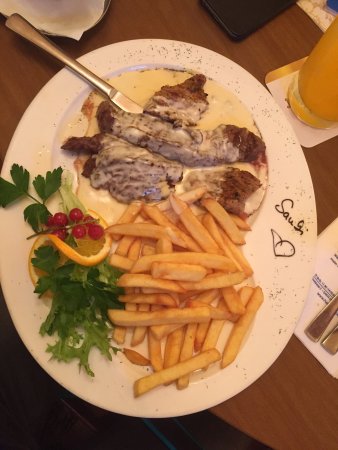
Image resolution: width=338 pixels, height=450 pixels. Find the location of `napkin`. napkin is located at coordinates (335, 359).